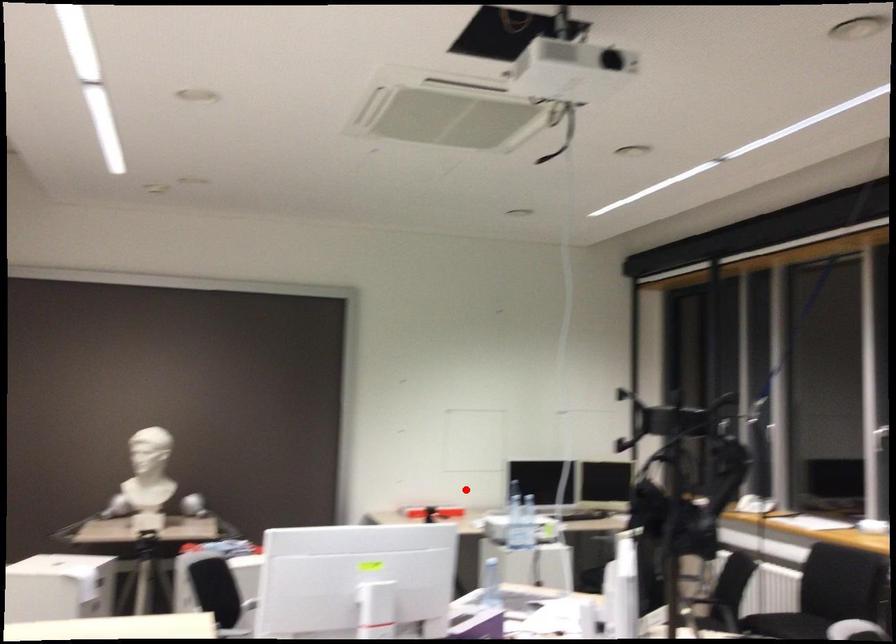
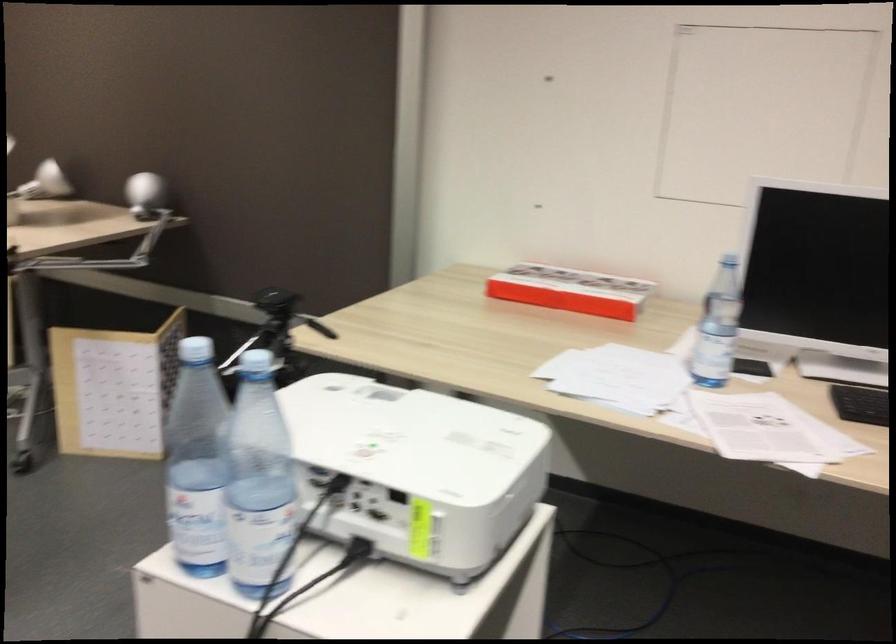
Where in the second image is the point corresponding to the highlighted location from the first image?

(570, 290)